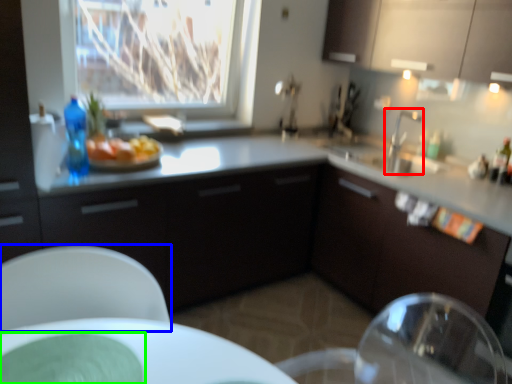
Question: Considering the real-world distances, which object is farthest from tap (highlighted by a red box)? chair (highlighted by a blue box) or glass plate (highlighted by a green box)?

Choices:
 (A) chair
 (B) glass plate

Answer: (B)